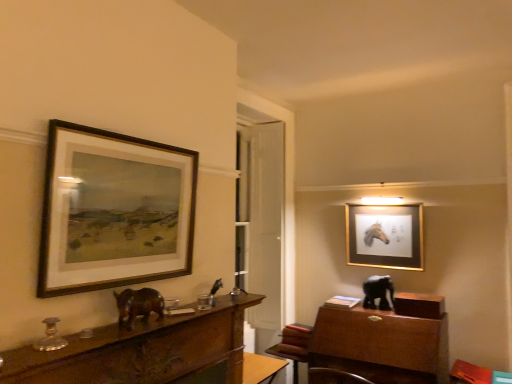
Question: From a real-world perspective, is shiny brown elephant at center, which appears as the 1th animal when viewed from the front, over wooden table at center?

Choices:
 (A) no
 (B) yes

Answer: (B)

Question: Is shiny brown elephant at center, which appears as the second animal when ordered from the bottom, further to camera compared to wooden table at center?

Choices:
 (A) no
 (B) yes

Answer: (A)

Question: Is shiny brown elephant at center, which appears as the second animal when ordered from the bottom, turned away from wooden table at center?

Choices:
 (A) no
 (B) yes

Answer: (A)

Question: Does shiny brown elephant at center, which appears as the second animal when ordered from the bottom, appear on the left side of wooden table at center?

Choices:
 (A) yes
 (B) no

Answer: (A)

Question: Can you confirm if shiny brown elephant at center, which is counted as the first animal, starting from the left, is smaller than wooden table at center?

Choices:
 (A) yes
 (B) no

Answer: (A)

Question: Is point (x=297, y=352) positioned closer to the camera than point (x=386, y=208)?

Choices:
 (A) farther
 (B) closer

Answer: (B)

Question: From a real-world perspective, relative to gold metallic picture frame at upper right, which appears as the second picture frame when viewed from the front, is wooden table at center vertically above or below?

Choices:
 (A) above
 (B) below

Answer: (B)

Question: Is wooden table at center bigger or smaller than gold metallic picture frame at upper right, which appears as the 1th picture frame when viewed from the back?

Choices:
 (A) small
 (B) big

Answer: (B)

Question: Would you say wooden table at center is to the left or to the right of gold metallic picture frame at upper right, which appears as the second picture frame when viewed from the front, in the picture?

Choices:
 (A) right
 (B) left

Answer: (B)

Question: From the image's perspective, is brown wooden desk at left above or below gold metallic picture frame at upper right, which appears as the second picture frame when viewed from the front?

Choices:
 (A) above
 (B) below

Answer: (B)

Question: Looking at the image, does brown wooden desk at left seem bigger or smaller compared to gold metallic picture frame at upper right, acting as the 1th picture frame starting from the right?

Choices:
 (A) small
 (B) big

Answer: (A)

Question: In the image, is brown wooden desk at left positioned in front of or behind gold metallic picture frame at upper right, which appears as the 1th picture frame when viewed from the back?

Choices:
 (A) behind
 (B) front

Answer: (B)

Question: Considering the positions of point (212, 347) and point (416, 238), is point (212, 347) closer or farther from the camera than point (416, 238)?

Choices:
 (A) farther
 (B) closer

Answer: (B)

Question: Is gold metallic picture frame at upper right, marked as the second picture frame in a left-to-right arrangement, wider or thinner than wooden table at center?

Choices:
 (A) wide
 (B) thin

Answer: (B)

Question: Based on their sizes in the image, would you say gold metallic picture frame at upper right, marked as the second picture frame in a left-to-right arrangement, is bigger or smaller than wooden table at center?

Choices:
 (A) big
 (B) small

Answer: (B)